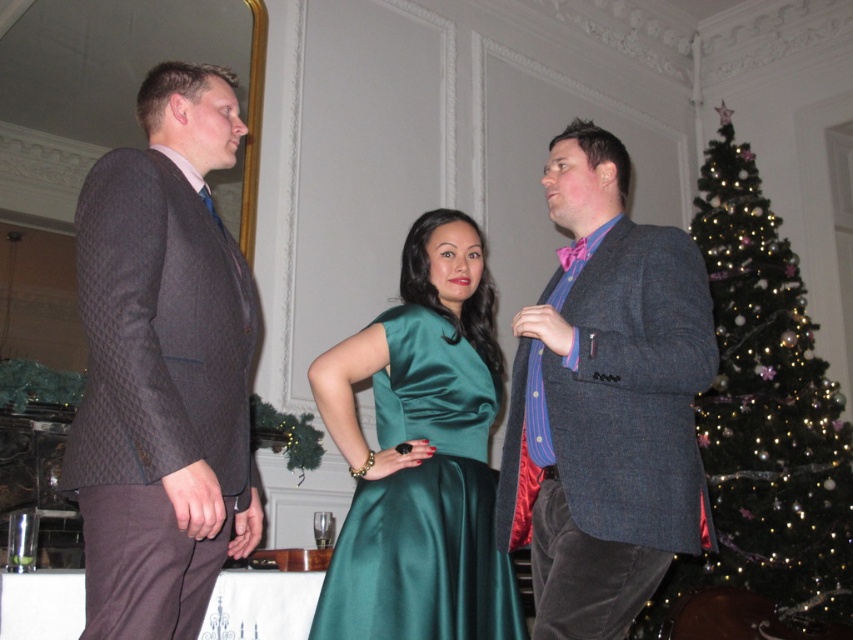
Question: Based on their relative distances, which object is farther from the shiny green christmas tree at right?

Choices:
 (A) matte black suit at left
 (B) textured gray blazer at center
 (C) dark brown textured suit at left

Answer: (C)

Question: Which of these objects is positioned closest to the shiny green christmas tree at right?

Choices:
 (A) matte black suit at left
 (B) textured gray blazer at center
 (C) satin green dress at center

Answer: (C)

Question: Is matte black suit at left to the right of textured gray blazer at center from the viewer's perspective?

Choices:
 (A) no
 (B) yes

Answer: (A)

Question: Which point is farther from the camera taking this photo?

Choices:
 (A) (428, 625)
 (B) (115, 241)
 (C) (173, 132)
 (D) (556, 214)

Answer: (D)

Question: In this image, where is textured gray blazer at center located relative to shiny green christmas tree at right?

Choices:
 (A) right
 (B) left

Answer: (B)

Question: Observing the image, what is the correct spatial positioning of matte black suit at left in reference to shiny green christmas tree at right?

Choices:
 (A) below
 (B) above

Answer: (B)